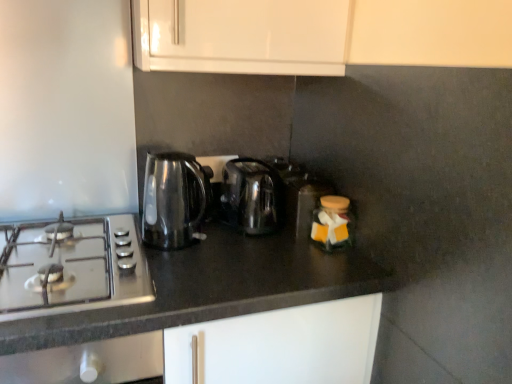
At what (x,y) coordinates should I click in order to perform the action: click on free space in front of translucent plastic container at center, arranged as the second appliance when viewed from the front. Please return your answer as a coordinate pair (x, y). Looking at the image, I should click on pyautogui.click(x=311, y=260).